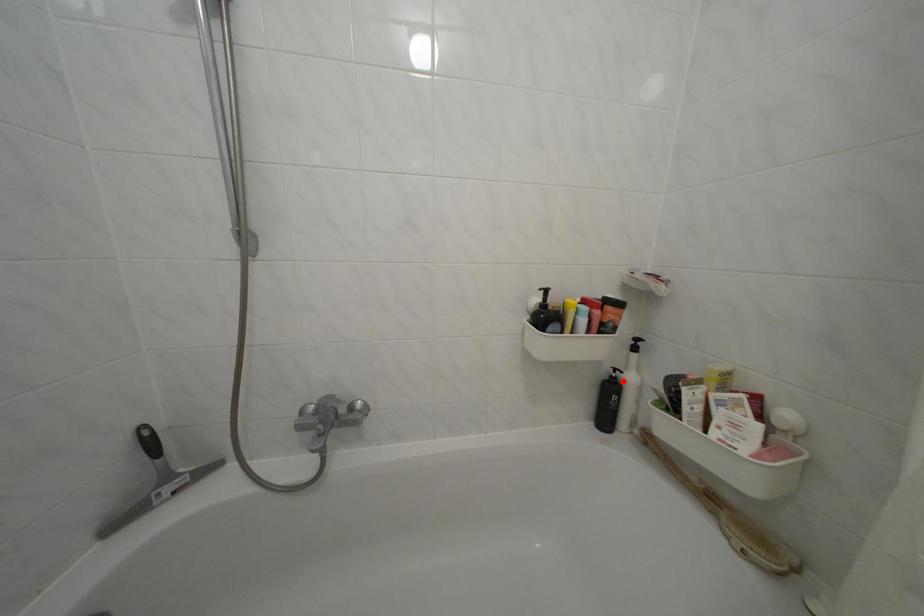
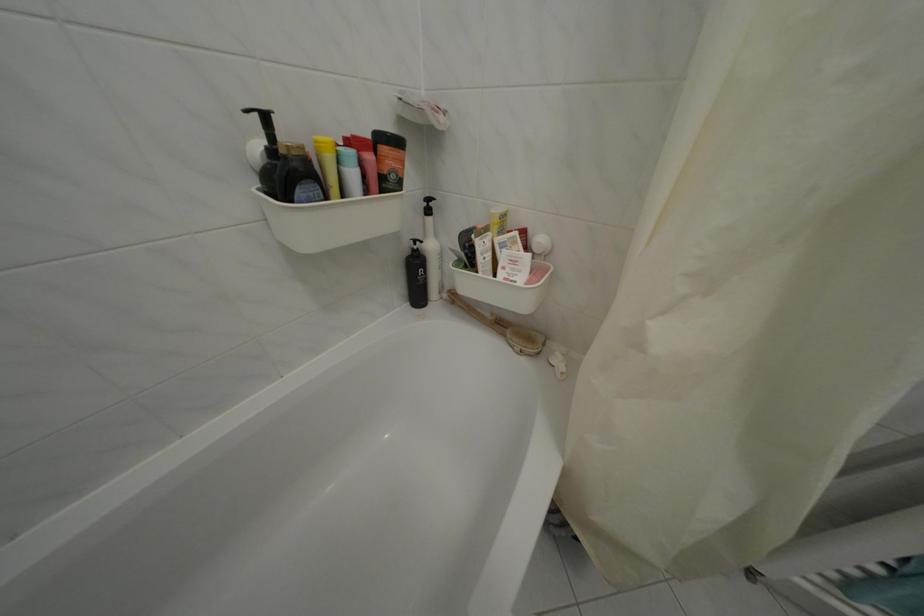
Find the pixel in the second image that matches the highlighted location in the first image.

(424, 254)